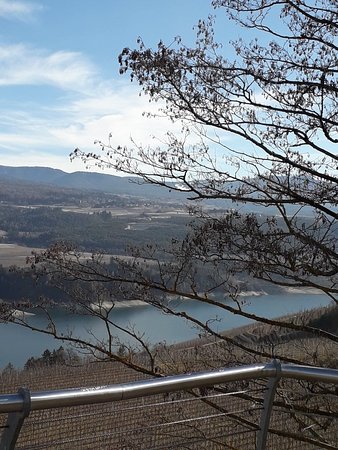
At what (x,y) coordinates should I click in order to perform the action: click on bend in handrail. Please return your answer as a coordinate pair (x, y). The height and width of the screenshot is (450, 338). Looking at the image, I should click on (269, 370).